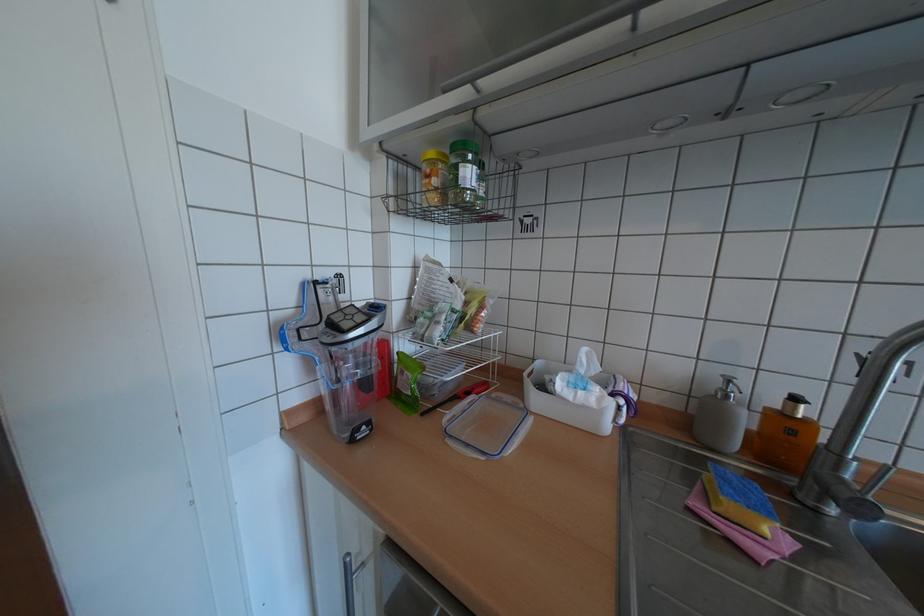
At what (x,y) coordinates should I click in order to perform the action: click on orange bottle pump. Please return your answer as a coordinate pair (x, y). The width and height of the screenshot is (924, 616). Looking at the image, I should click on (794, 405).